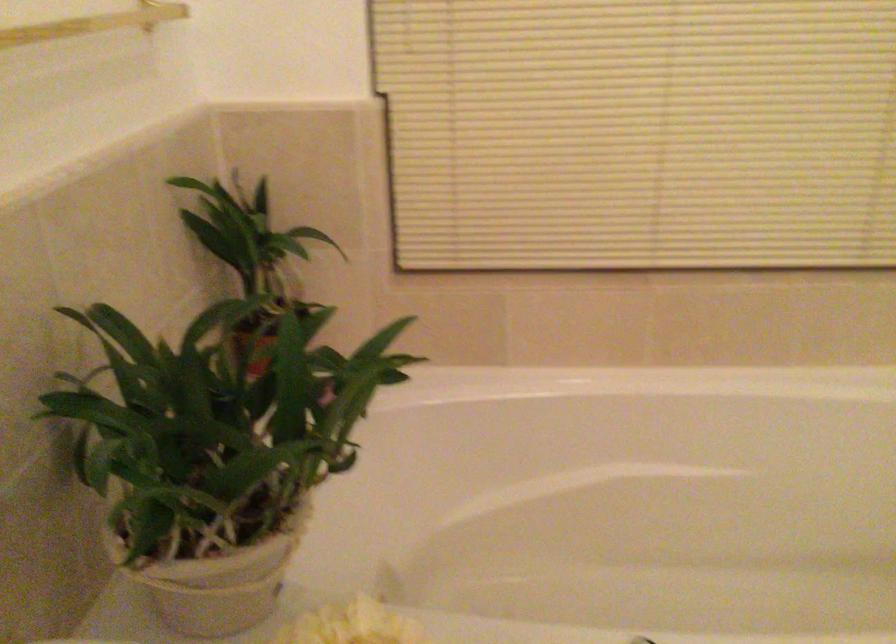
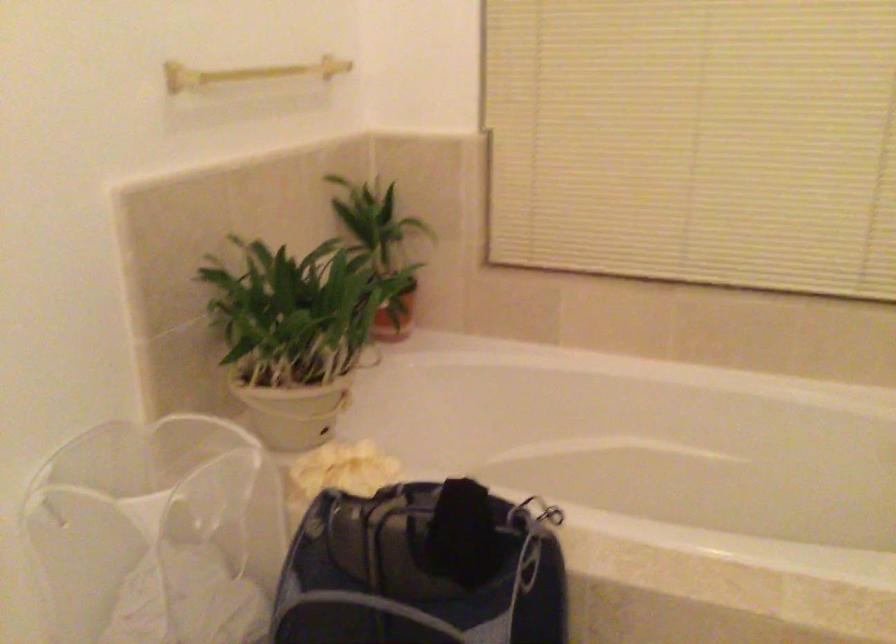
Question: I am providing you with two images of the same scene from different viewpoints. After the viewpoint changes to image2, which objects are now occluded?

Choices:
 (A) bag of coffee
 (B) white plant pot
 (C) gold towel rack
 (D) gold towel bar

Answer: (D)